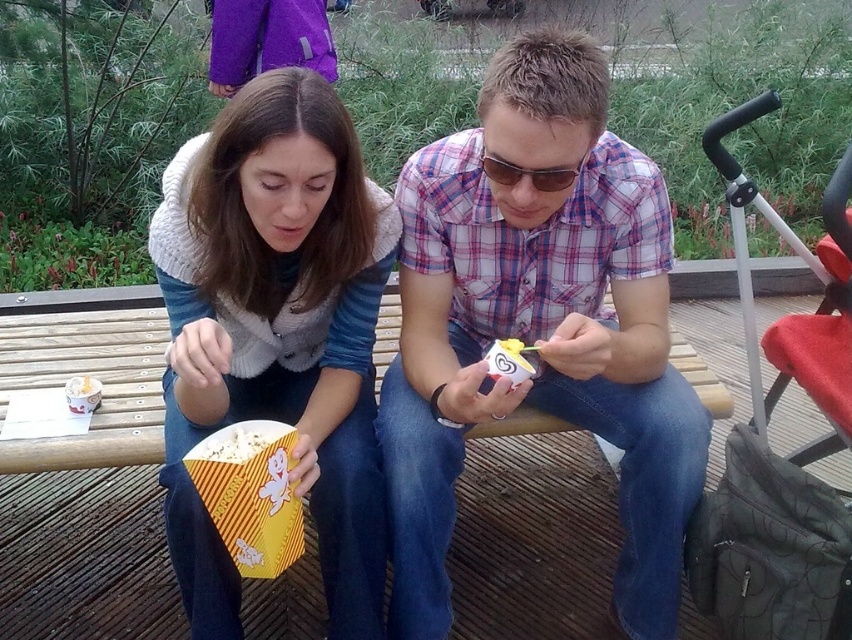
You are a photographer taking a picture of the scene. You need to ensure that the plaid shirt at center and the metallic silver baby carriage at right are both visible in the frame. Based on their positions, which one should you focus on first to ensure both are in the frame?

The plaid shirt at center is below the metallic silver baby carriage at right, so you should focus on the metallic silver baby carriage at right first to ensure both are in the frame.

You are a photographer taking a picture of the plaid shirt at center and the matte yellow popcorn box at center. Which object should you focus on first if you want to ensure both are in focus, considering their sizes and positions?

The plaid shirt at center is wider than the matte yellow popcorn box at center, so focusing on the plaid shirt at center first would help ensure both are in focus since it is larger and occupies more space in the frame.